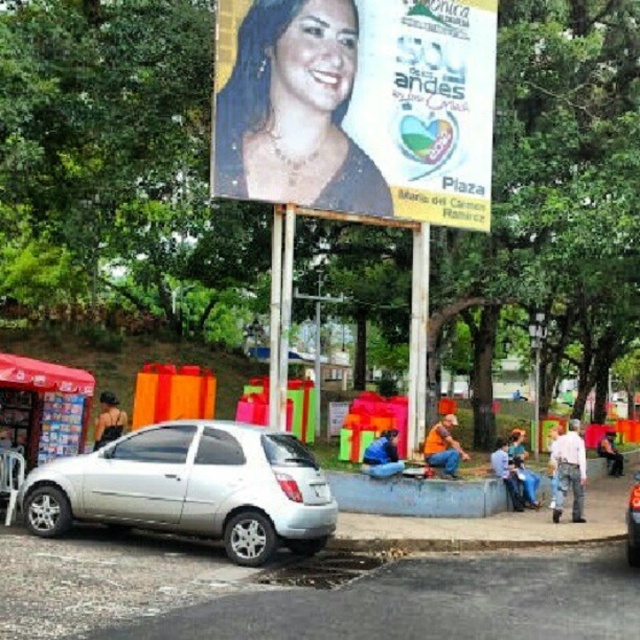
Which of these two, white cotton shirt at right or blue denim jeans at lower right, stands taller?

white cotton shirt at right is taller.

What do you see at coordinates (568, 472) in the screenshot?
I see `white cotton shirt at right` at bounding box center [568, 472].

Which is in front, point (552, 506) or point (518, 477)?

Point (552, 506) is more forward.

Identify the location of white cotton shirt at right. (568, 472).

Is matte plastic billboard at upper center thinner than silver metallic car at center?

Indeed, matte plastic billboard at upper center has a lesser width compared to silver metallic car at center.

How much distance is there between matte plastic billboard at upper center and silver metallic car at center?

matte plastic billboard at upper center and silver metallic car at center are 6.71 meters apart.

Locate an element on the screen. matte plastic billboard at upper center is located at coordinates (356, 106).

Where is `matte plastic billboard at upper center`? matte plastic billboard at upper center is located at coordinates (356, 106).

In the scene shown: Is black fabric tank top at lower left wider than smooth leather jacket at lower right?

Incorrect, black fabric tank top at lower left's width does not surpass smooth leather jacket at lower right's.

Can you confirm if black fabric tank top at lower left is shorter than smooth leather jacket at lower right?

Yes, black fabric tank top at lower left is shorter than smooth leather jacket at lower right.

Does point (108, 428) come closer to viewer compared to point (621, 458)?

Yes, point (108, 428) is in front of point (621, 458).

Where is `black fabric tank top at lower left`? This screenshot has width=640, height=640. black fabric tank top at lower left is located at coordinates (108, 419).